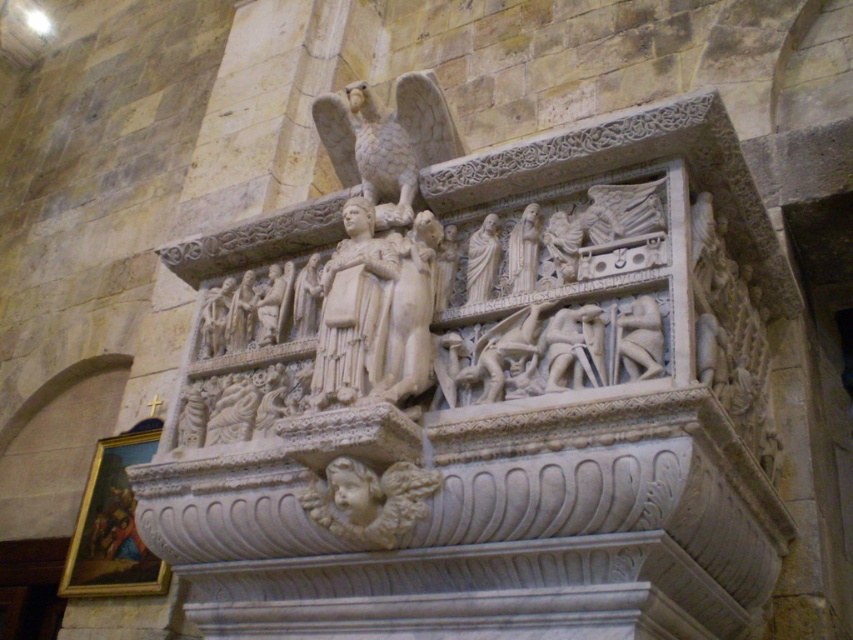
You are an architect examining a historical building. You need to locate the white marble eagle at upper center. Where exactly is it positioned in the image?

The white marble eagle at upper center is positioned at point (x=387, y=140) in the image.

You are an art conservator tasked with measuring the spacing between two white marble sculptures on a stone structure. You need to determine if a 1.2 meter ladder can fit between them without touching either. Based on the scene, can the ladder be placed between the white marble eagle at upper center and the white marble statue at center?

The distance between the white marble eagle at upper center and the white marble statue at center is 1.16 meters. Since the ladder is 1.2 meters long, it would be slightly too long to fit between them without touching the sculptures.